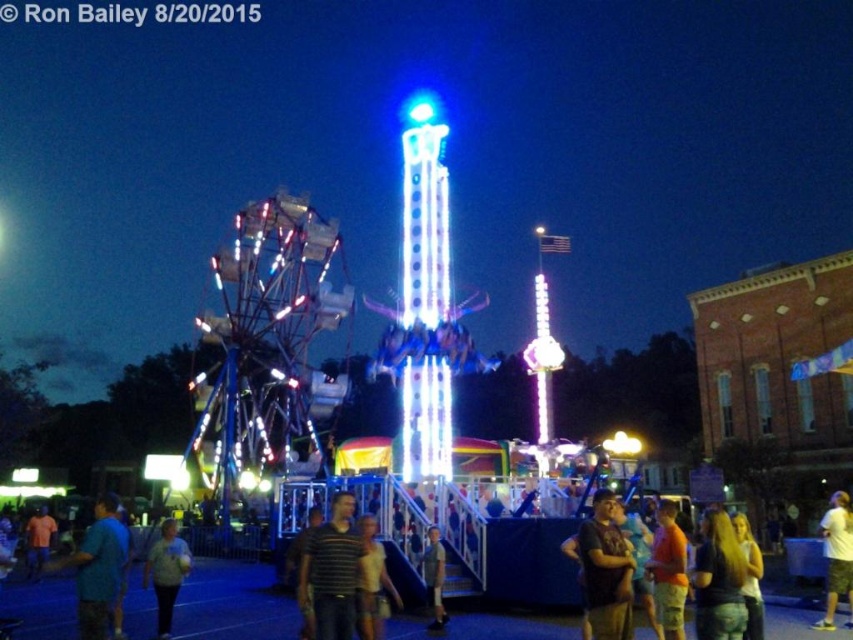
You are standing at the center of the carnival and see both the orange cotton shirt at lower right and the light blue shirt at lower left. Which shirt is nearer to you?

The orange cotton shirt at lower right is closer to the viewer than the light blue shirt at lower left.